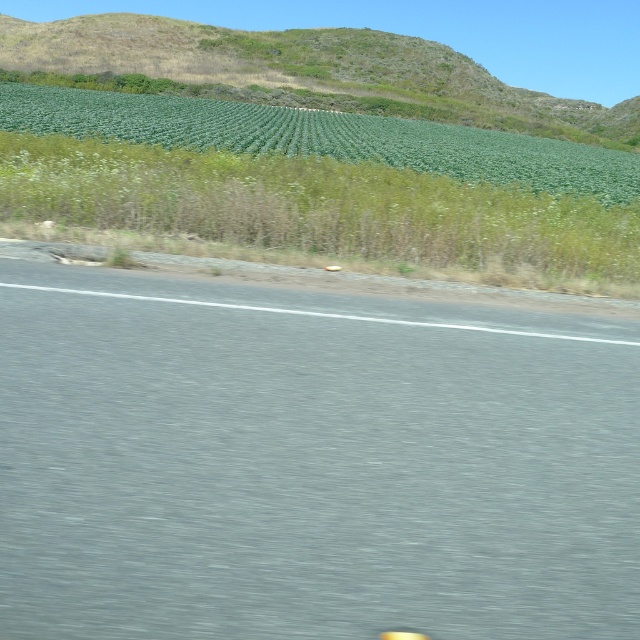
Question: Among these objects, which one is nearest to the camera?

Choices:
 (A) green grassy hill at upper center
 (B) green leafy plants at upper center

Answer: (B)

Question: Is gray asphalt road at center to the left of green grassy hill at upper center from the viewer's perspective?

Choices:
 (A) no
 (B) yes

Answer: (A)

Question: Is gray asphalt road at center above green leafy plants at upper center?

Choices:
 (A) no
 (B) yes

Answer: (A)

Question: Which of the following is the closest to the observer?

Choices:
 (A) (445, 52)
 (B) (563, 172)

Answer: (B)

Question: Among these objects, which one is farthest from the camera?

Choices:
 (A) green leafy plants at upper center
 (B) green grassy hill at upper center

Answer: (B)

Question: Is gray asphalt road at center smaller than green grassy hill at upper center?

Choices:
 (A) yes
 (B) no

Answer: (A)